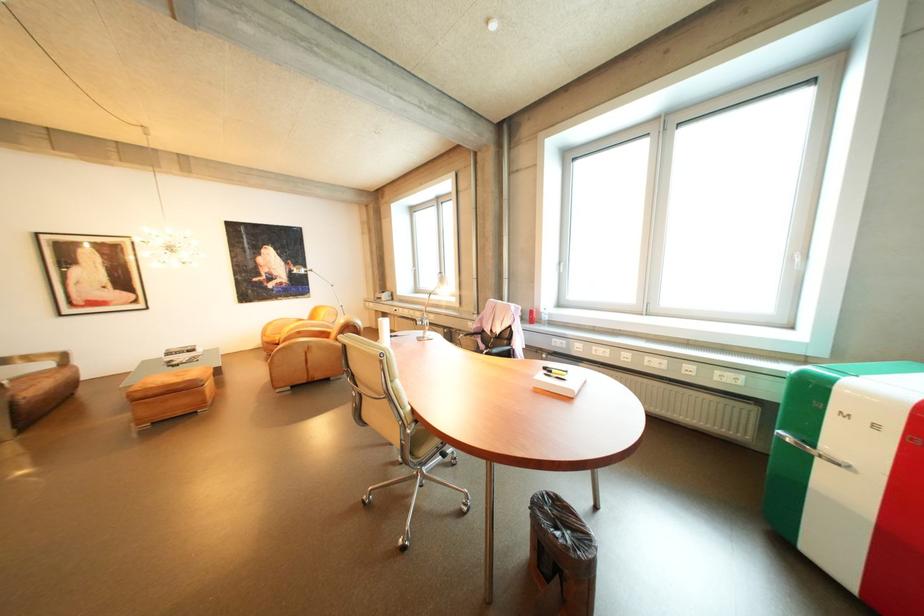
The height and width of the screenshot is (616, 924). Identify the location of silver refrigerator handle. (812, 450).